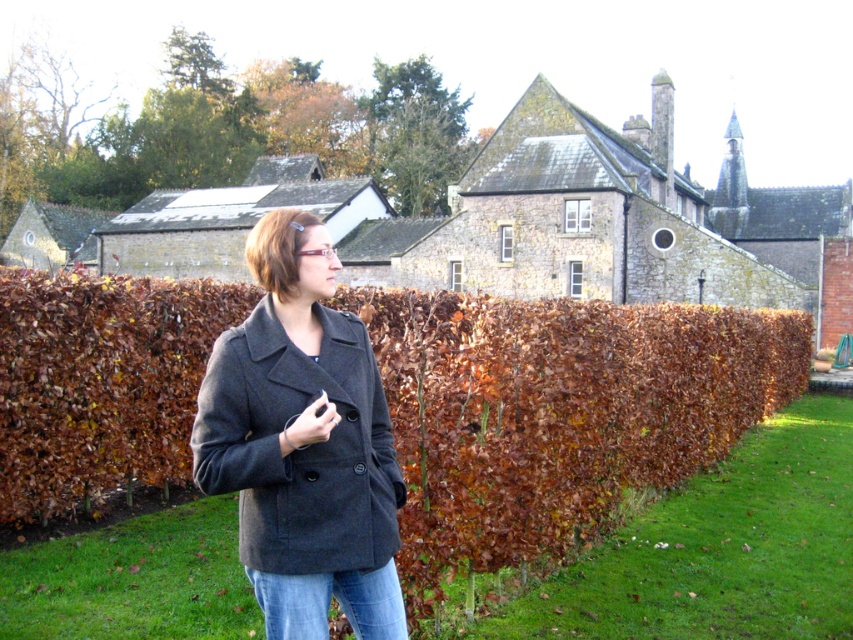
Does brown leafy hedge at center appear over matte gray coat at center?

Yes.

Where is `brown leafy hedge at center`? This screenshot has height=640, width=853. brown leafy hedge at center is located at coordinates (556, 413).